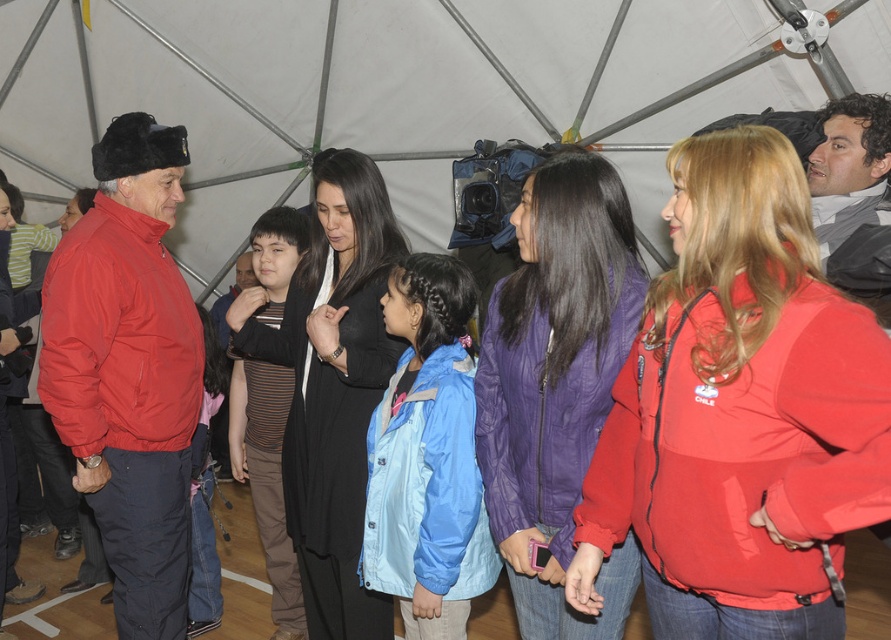
Is point (823, 285) closer to camera compared to point (505, 552)?

Yes.

Is point (695, 515) farther from camera compared to point (583, 252)?

No.

Who is more distant from viewer, (738,520) or (611,628)?

Point (611,628)

Find the location of a particular element. The height and width of the screenshot is (640, 891). matte red jacket at center is located at coordinates (740, 412).

Which is above, white fabric canopy at upper center or matte red jacket at center?

white fabric canopy at upper center is higher up.

Which is in front, point (100, 8) or point (609, 436)?

Point (609, 436)

Where is `white fabric canopy at upper center`? This screenshot has width=891, height=640. white fabric canopy at upper center is located at coordinates (338, 92).

Which is behind, point (415, 19) or point (487, 305)?

The point (415, 19) is behind.

You are a GUI agent. You are given a task and a screenshot of the screen. Output one action in this format:
    pyautogui.click(x=<x>, y=<y>)
    Task: Click on the white fabric canopy at upper center
    This screenshot has height=640, width=891.
    Given the screenshot: What is the action you would take?
    pyautogui.click(x=338, y=92)

Find the location of a particular element. This screenshot has width=891, height=640. white fabric canopy at upper center is located at coordinates (338, 92).